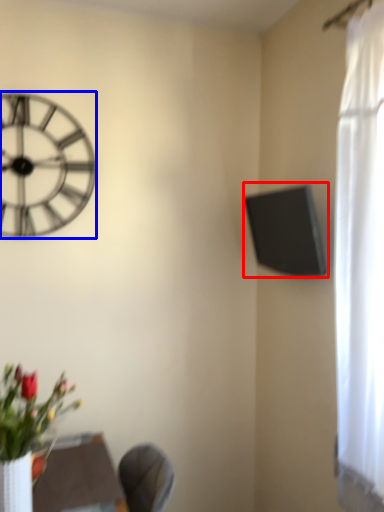
Question: Which object is closer to the camera taking this photo, window screen (highlighted by a red box) or wall clock (highlighted by a blue box)?

Choices:
 (A) window screen
 (B) wall clock

Answer: (A)